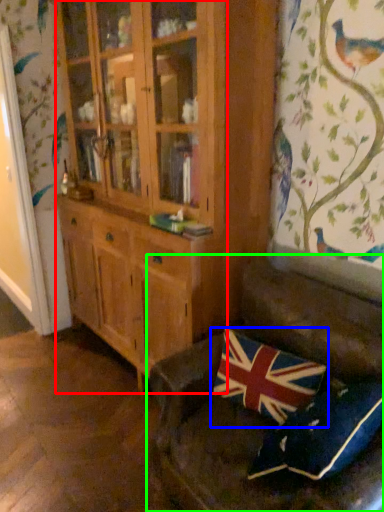
Question: Which object is the farthest from cabinetry (highlighted by a red box)? Choose among these: pillow (highlighted by a blue box) or studio couch (highlighted by a green box).

Choices:
 (A) pillow
 (B) studio couch

Answer: (A)